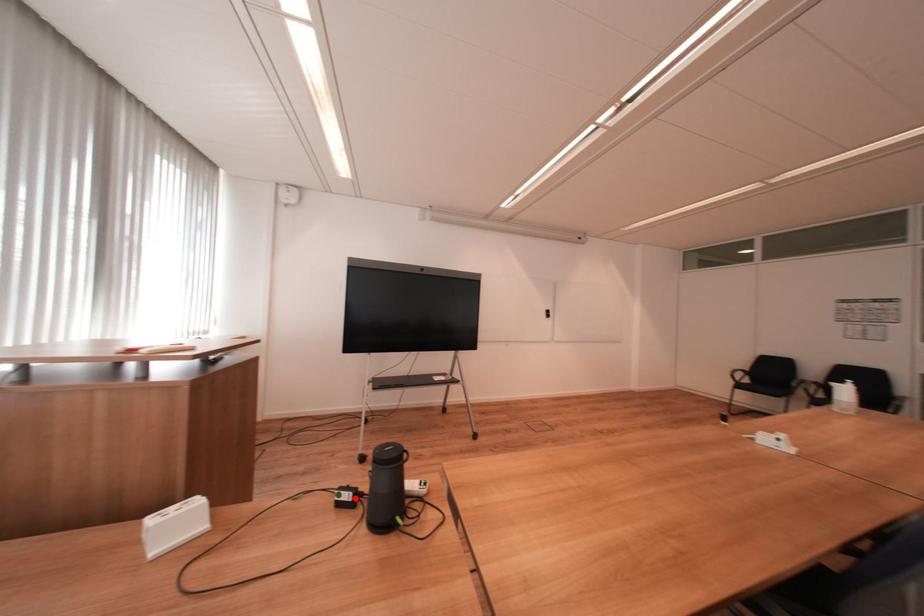
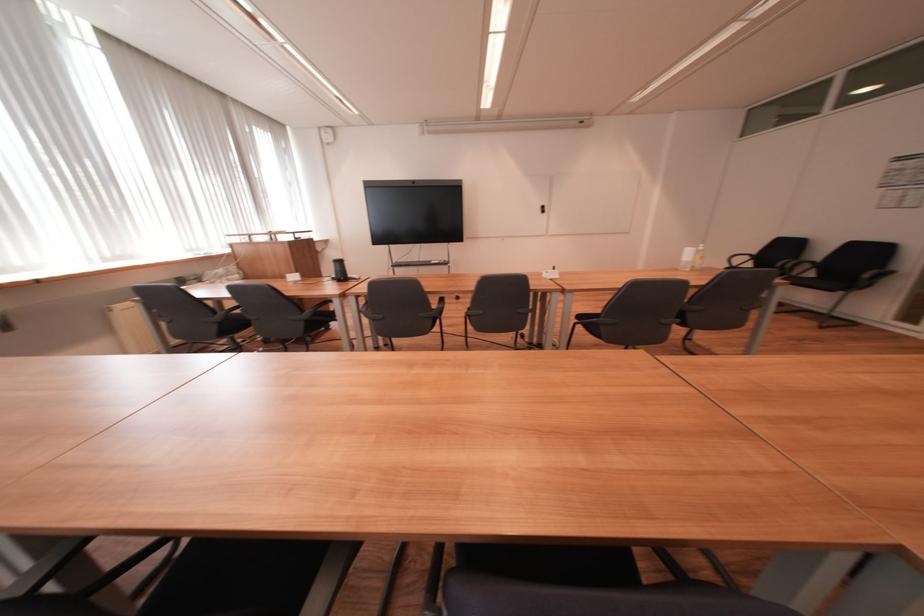
Locate, in the second image, the point that corresponds to the highlighted location in the first image.

(343, 278)